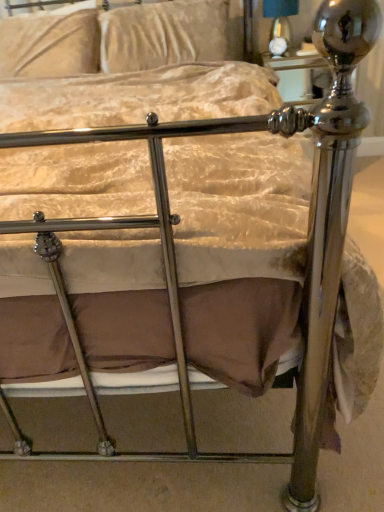
Question: Can velvet beige pillow at upper center, which is the first pillow in right-to-left order, be found inside matte black lampshade at upper center?

Choices:
 (A) yes
 (B) no

Answer: (B)

Question: From a real-world perspective, is matte black lampshade at upper center below velvet beige pillow at upper center, the 2th pillow positioned from the left?

Choices:
 (A) yes
 (B) no

Answer: (A)

Question: Considering the relative sizes of matte black lampshade at upper center and velvet beige pillow at upper center, the 2th pillow positioned from the left, in the image provided, is matte black lampshade at upper center bigger than velvet beige pillow at upper center, the 2th pillow positioned from the left,?

Choices:
 (A) yes
 (B) no

Answer: (B)

Question: Does matte black lampshade at upper center appear on the left side of velvet beige pillow at upper center, which is the first pillow in right-to-left order?

Choices:
 (A) no
 (B) yes

Answer: (A)

Question: Can you confirm if matte black lampshade at upper center is taller than velvet beige pillow at upper center, the 2th pillow positioned from the left?

Choices:
 (A) no
 (B) yes

Answer: (A)

Question: Considering the relative positions of velvet beige pillow at upper center, which is the first pillow in right-to-left order, and matte black lampshade at upper center in the image provided, is velvet beige pillow at upper center, which is the first pillow in right-to-left order, to the left or to the right of matte black lampshade at upper center?

Choices:
 (A) right
 (B) left

Answer: (B)

Question: Is point (223, 57) closer or farther from the camera than point (281, 0)?

Choices:
 (A) closer
 (B) farther

Answer: (A)

Question: From the image's perspective, is velvet beige pillow at upper center, which is the first pillow in right-to-left order, positioned above or below matte black lampshade at upper center?

Choices:
 (A) above
 (B) below

Answer: (B)

Question: Is velvet beige pillow at upper center, the 2th pillow positioned from the left, inside the boundaries of matte black lampshade at upper center, or outside?

Choices:
 (A) outside
 (B) inside

Answer: (A)

Question: From a real-world perspective, is matte black lampshade at upper center physically located above or below velvet beige pillow at upper center, the 2th pillow positioned from the left?

Choices:
 (A) below
 (B) above

Answer: (A)

Question: In terms of height, does matte black lampshade at upper center look taller or shorter compared to velvet beige pillow at upper center, the 2th pillow positioned from the left?

Choices:
 (A) tall
 (B) short

Answer: (B)

Question: Visually, is matte black lampshade at upper center positioned to the left or to the right of velvet beige pillow at upper center, which is the first pillow in right-to-left order?

Choices:
 (A) left
 (B) right

Answer: (B)

Question: From the image's perspective, is matte black lampshade at upper center positioned above or below velvet beige pillow at upper center, which is the first pillow in right-to-left order?

Choices:
 (A) below
 (B) above

Answer: (B)

Question: Looking at their shapes, would you say matte black lampshade at upper center is wider or thinner than velvet beige pillow at upper left, the second pillow viewed from the right?

Choices:
 (A) wide
 (B) thin

Answer: (B)

Question: Based on their sizes in the image, would you say matte black lampshade at upper center is bigger or smaller than velvet beige pillow at upper left, the second pillow viewed from the right?

Choices:
 (A) small
 (B) big

Answer: (A)